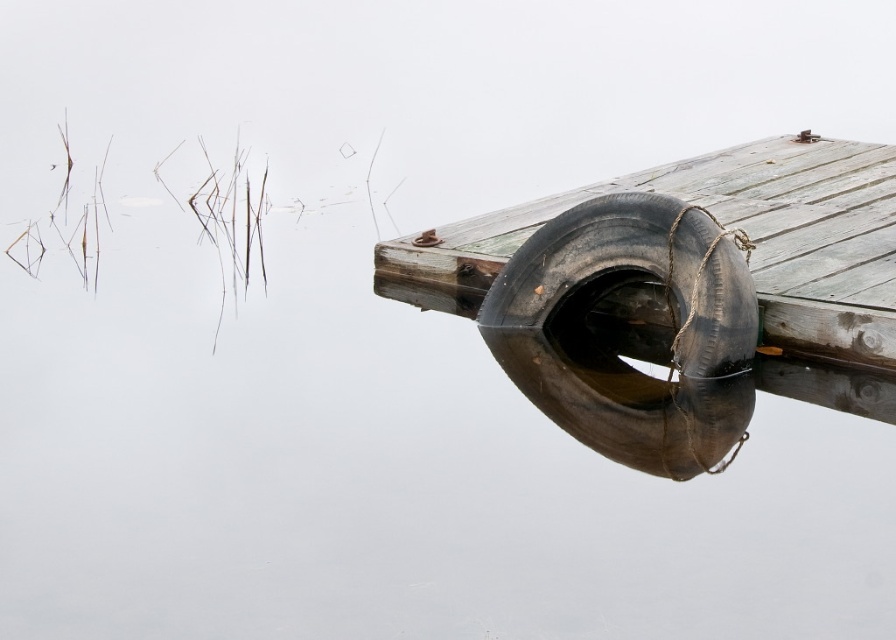
Who is shorter, rubber tire at center or black rubber tire at right?

rubber tire at center is shorter.

Does rubber tire at center appear on the left side of black rubber tire at right?

Incorrect, rubber tire at center is not on the left side of black rubber tire at right.

Is point (885, 195) farther from viewer compared to point (593, 236)?

Yes, it is behind point (593, 236).

The width and height of the screenshot is (896, 640). Identify the location of rubber tire at center. (739, 228).